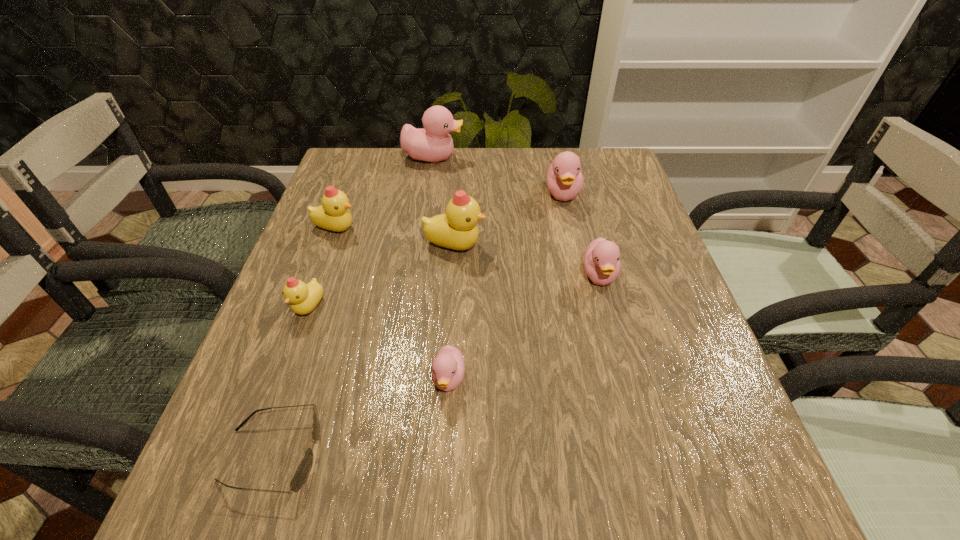
Locate an element on the screen. object positioned at the near edge is located at coordinates (304, 468).

Find the location of a particular element. The image size is (960, 540). sunglasses at the left edge is located at coordinates (304, 468).

Identify the location of object positioned at the near left corner. (304, 468).

You are a GUI agent. You are given a task and a screenshot of the screen. Output one action in this format:
    pyautogui.click(x=<x>, y=<y>)
    Task: Click on the object that is at the far right corner
    The image size is (960, 540).
    Given the screenshot: What is the action you would take?
    pyautogui.click(x=564, y=178)

Locate an element on the screen. The image size is (960, 540). vacant space at the far edge of the desktop is located at coordinates (556, 154).

In the image, there is a desktop. At what (x,y) coordinates should I click in order to perform the action: click on vacant space at the near edge. Please return your answer as a coordinate pair (x, y). Image resolution: width=960 pixels, height=540 pixels. Looking at the image, I should click on (383, 482).

You are a GUI agent. You are given a task and a screenshot of the screen. Output one action in this format:
    pyautogui.click(x=<x>, y=<y>)
    Task: Click on the blank area at the left edge
    The image size is (960, 540).
    Given the screenshot: What is the action you would take?
    pyautogui.click(x=378, y=216)

You are a GUI agent. You are given a task and a screenshot of the screen. Output one action in this format:
    pyautogui.click(x=<x>, y=<y>)
    Task: Click on the vacant area at the right edge of the desktop
    
    Given the screenshot: What is the action you would take?
    pyautogui.click(x=623, y=229)

The width and height of the screenshot is (960, 540). In the image, there is a desktop. What are the coordinates of `free space at the far left corner` in the screenshot? It's located at (365, 190).

This screenshot has width=960, height=540. In the image, there is a desktop. In order to click on vacant space at the far right corner in this screenshot , I will do `click(627, 186)`.